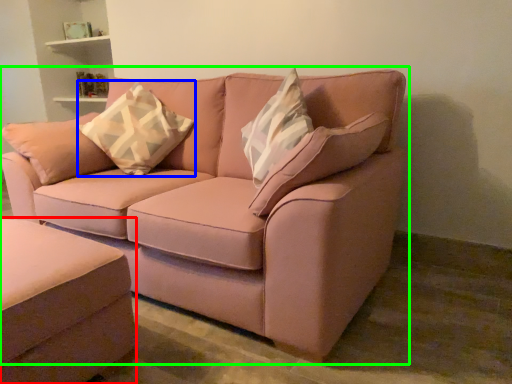
Question: Which object is positioned closest to studio couch (highlighted by a red box)? Select from throw pillow (highlighted by a blue box) and studio couch (highlighted by a green box).

Choices:
 (A) throw pillow
 (B) studio couch

Answer: (B)